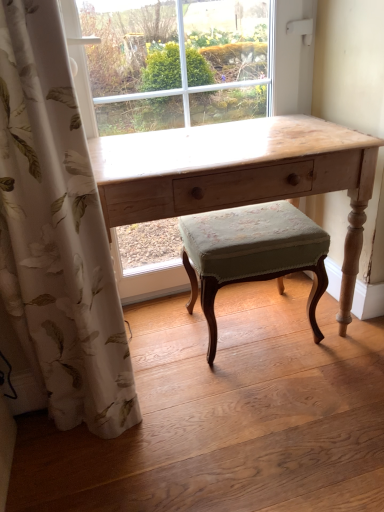
The width and height of the screenshot is (384, 512). I want to click on vacant space in front of white floral fabric curtain at left, so click(x=84, y=478).